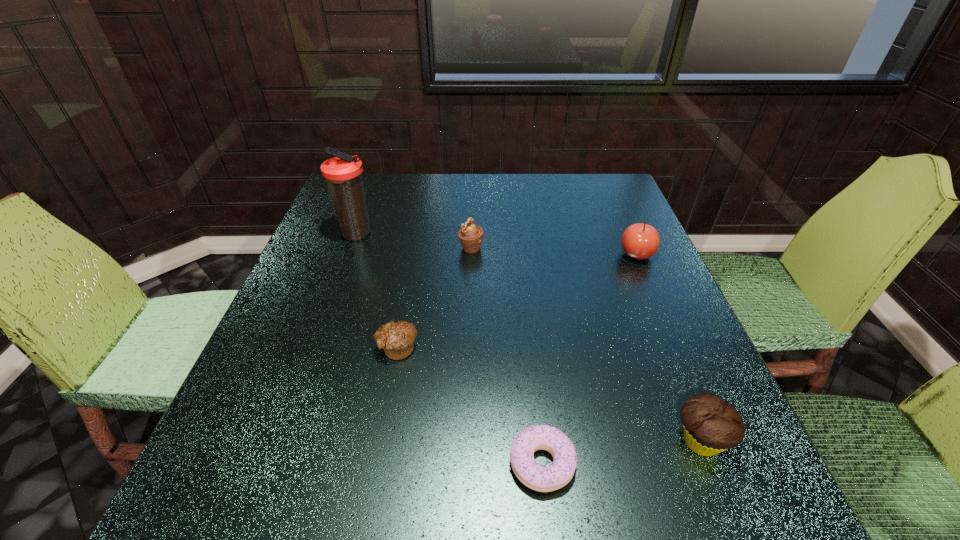
Locate an element on the screen. The height and width of the screenshot is (540, 960). free space located on the back of the leftmost object is located at coordinates (371, 195).

Locate an element on the screen. Image resolution: width=960 pixels, height=540 pixels. blank area located on the front of the apple is located at coordinates (683, 361).

This screenshot has width=960, height=540. I want to click on vacant space positioned 0.110m on the front of the second muffin from left to right, so click(469, 286).

Locate an element on the screen. The height and width of the screenshot is (540, 960). free space located on the back of the rightmost muffin is located at coordinates (635, 276).

You are a GUI agent. You are given a task and a screenshot of the screen. Output one action in this format:
    pyautogui.click(x=<x>, y=<y>)
    Task: Click on the vacant region located 0.100m on the front of the shortest muffin
    The width and height of the screenshot is (960, 540).
    Given the screenshot: What is the action you would take?
    pyautogui.click(x=387, y=409)

You are a GUI agent. You are given a task and a screenshot of the screen. Output one action in this format:
    pyautogui.click(x=<x>, y=<y>)
    Task: Click on the vacant area situated on the left of the doughnut
    
    Given the screenshot: What is the action you would take?
    pyautogui.click(x=408, y=463)

I want to click on object at the near edge, so click(x=537, y=477).

You are a GUI agent. You are given a task and a screenshot of the screen. Output one action in this format:
    pyautogui.click(x=<x>, y=<y>)
    Task: Click on the object located in the left edge section of the desktop
    Image resolution: width=960 pixels, height=540 pixels.
    Given the screenshot: What is the action you would take?
    pyautogui.click(x=343, y=174)

You are a GUI agent. You are given a task and a screenshot of the screen. Output one action in this format:
    pyautogui.click(x=<x>, y=<y>)
    Task: Click on the apple that is at the right edge
    Image resolution: width=960 pixels, height=540 pixels.
    Given the screenshot: What is the action you would take?
    pyautogui.click(x=640, y=241)

Image resolution: width=960 pixels, height=540 pixels. I want to click on muffin that is at the right edge, so click(x=710, y=426).